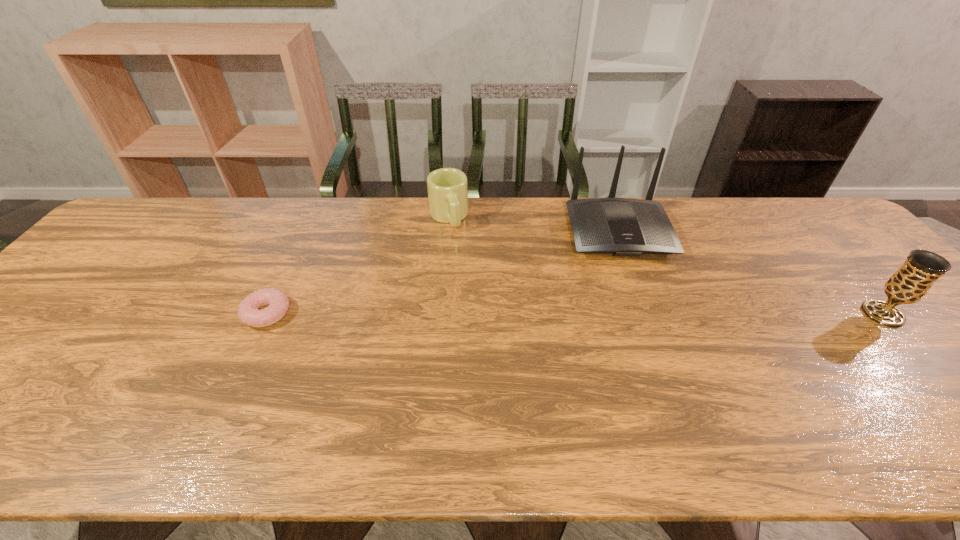
The width and height of the screenshot is (960, 540). Identify the location of vacant space located 0.120m with the handle on the side of the second object from left to right. (462, 258).

Identify the location of free location located with the handle on the side of the second object from left to right. (471, 286).

This screenshot has width=960, height=540. I want to click on vacant space situated with the handle on the side of the second object from left to right, so click(x=474, y=293).

Find the location of a particular element. The width and height of the screenshot is (960, 540). free space located on the front-facing side of the second object from right to left is located at coordinates (648, 321).

Find the location of a particular element. free space located 0.230m on the front-facing side of the second object from right to left is located at coordinates (649, 324).

Identify the location of vacant space located on the front-facing side of the second object from right to left. This screenshot has height=540, width=960. (660, 357).

The height and width of the screenshot is (540, 960). What are the coordinates of `mug that is positioned at the far edge` in the screenshot? It's located at (447, 188).

This screenshot has height=540, width=960. Find the location of `router at the far edge`. router at the far edge is located at coordinates (620, 226).

Locate an element on the screen. This screenshot has width=960, height=540. object that is positioned at the right edge is located at coordinates (911, 282).

The width and height of the screenshot is (960, 540). In order to click on free space at the far edge of the desktop in this screenshot , I will do `click(343, 206)`.